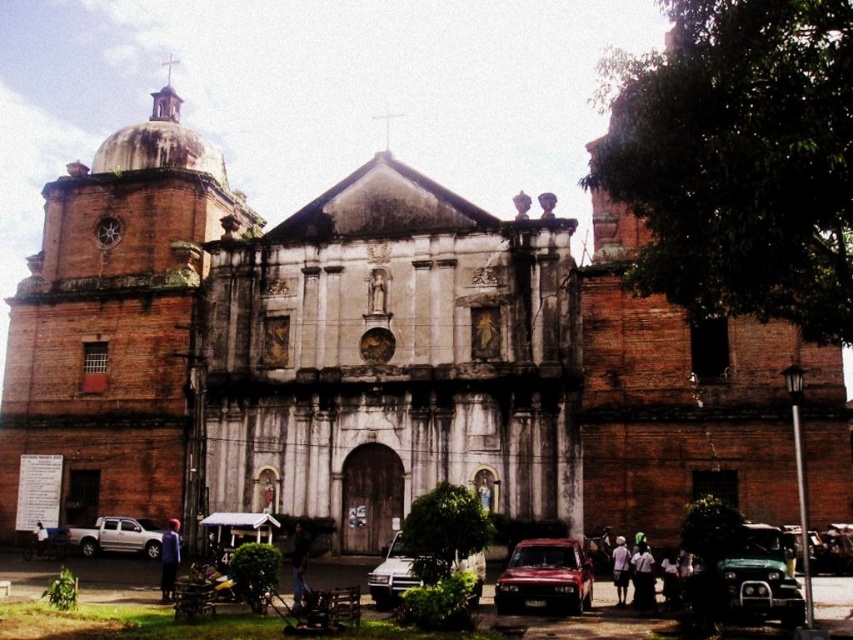
Question: Among these objects, which one is farthest from the camera?

Choices:
 (A) shiny red car at lower center
 (B) silver metallic sedan at center
 (C) blue fabric shirt at lower left
 (D) dark blue uniform at lower center

Answer: (C)

Question: Estimate the real-world distances between objects in this image. Which object is farther from the silver metallic sedan at center?

Choices:
 (A) silver metallic pickup truck at lower left
 (B) light brown leather jacket at lower center
 (C) white fabric shirt at lower left

Answer: (C)

Question: Can you confirm if dark blue uniform at lower center is smaller than blue fabric shirt at lower left?

Choices:
 (A) no
 (B) yes

Answer: (B)

Question: Among these points, which one is nearest to the camera?

Choices:
 (A) (294, 570)
 (B) (45, 536)
 (C) (560, 593)

Answer: (C)

Question: Is silver metallic sedan at center thinner than dark blue uniform at lower center?

Choices:
 (A) no
 (B) yes

Answer: (A)

Question: Does shiny red car at lower center have a smaller size compared to dark blue uniform at lower center?

Choices:
 (A) no
 (B) yes

Answer: (B)